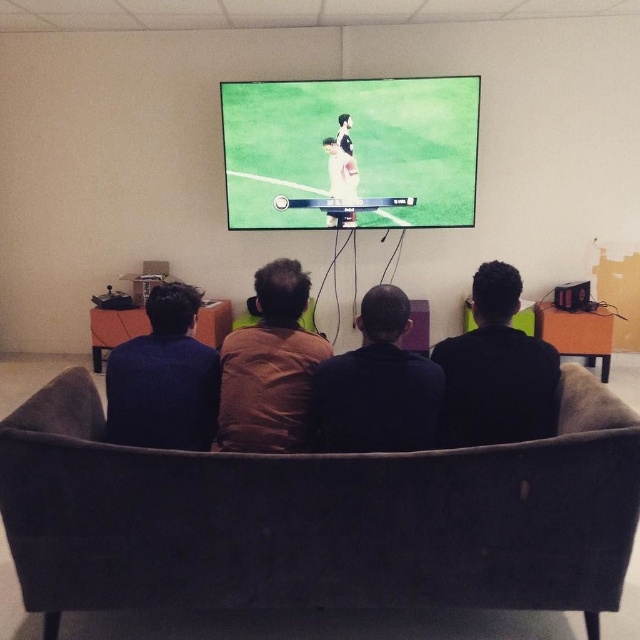
Question: Which of the following is the farthest from the observer?

Choices:
 (A) (422, 193)
 (B) (301, 291)
 (C) (152, 371)
 (D) (340, 179)

Answer: (A)

Question: Is dark fabric armchair at center above dark blue sweater at left?

Choices:
 (A) yes
 (B) no

Answer: (B)

Question: Does dark brown sweater at center appear on the left side of brown fabric shirt at center?

Choices:
 (A) no
 (B) yes

Answer: (A)

Question: From the image, what is the correct spatial relationship of dark fabric armchair at center in relation to dark blue sweater at left?

Choices:
 (A) right
 (B) left

Answer: (A)

Question: Based on their relative distances, which object is nearer to the dark brown sweater at center?

Choices:
 (A) dark fabric armchair at center
 (B) black matte shirt at center
 (C) green matte screen at upper center

Answer: (B)

Question: Which point is closer to the camera?

Choices:
 (A) brown fabric shirt at center
 (B) dark brown sweater at center

Answer: (B)